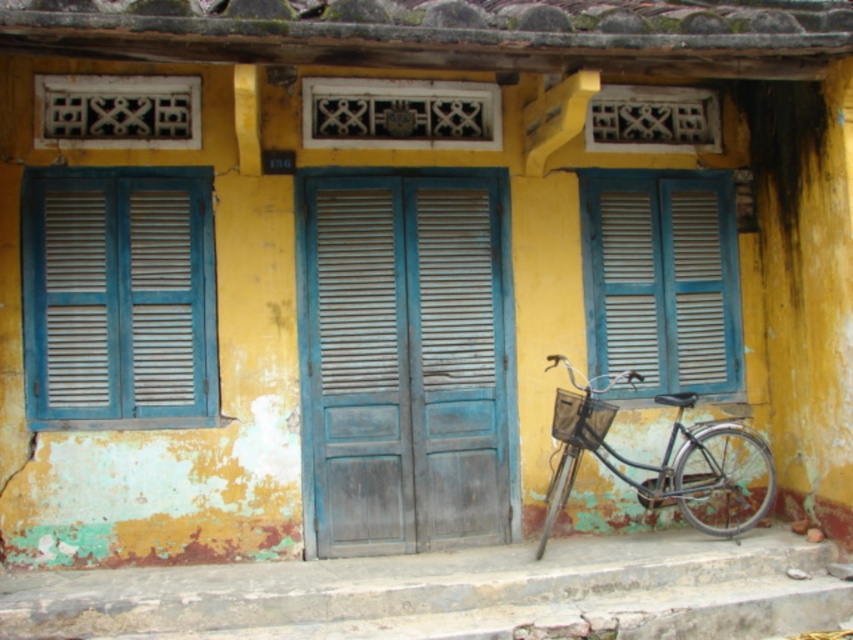
Question: Is concrete steps at lower center in front of blue wooden window at left?

Choices:
 (A) yes
 (B) no

Answer: (A)

Question: Which of the following is the farthest from the observer?

Choices:
 (A) wooden at center
 (B) blue wooden window at left
 (C) blue wooden window at right

Answer: (C)

Question: Can you confirm if wooden at center is wider than blue wooden window at right?

Choices:
 (A) no
 (B) yes

Answer: (B)

Question: Which of the following is the farthest from the observer?

Choices:
 (A) pyautogui.click(x=595, y=349)
 (B) pyautogui.click(x=68, y=296)
 (C) pyautogui.click(x=314, y=257)
 (D) pyautogui.click(x=669, y=452)

Answer: (A)

Question: Which object is the farthest from the metallic silver bicycle at right?

Choices:
 (A) blue wooden window at left
 (B) wooden at center

Answer: (A)

Question: Is blue wooden window at right above metallic silver bicycle at right?

Choices:
 (A) no
 (B) yes

Answer: (B)